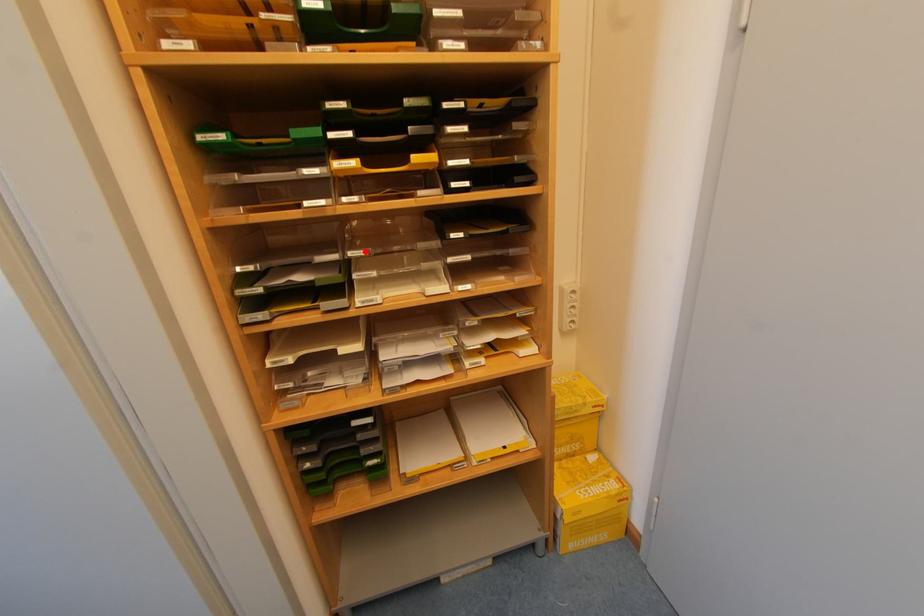
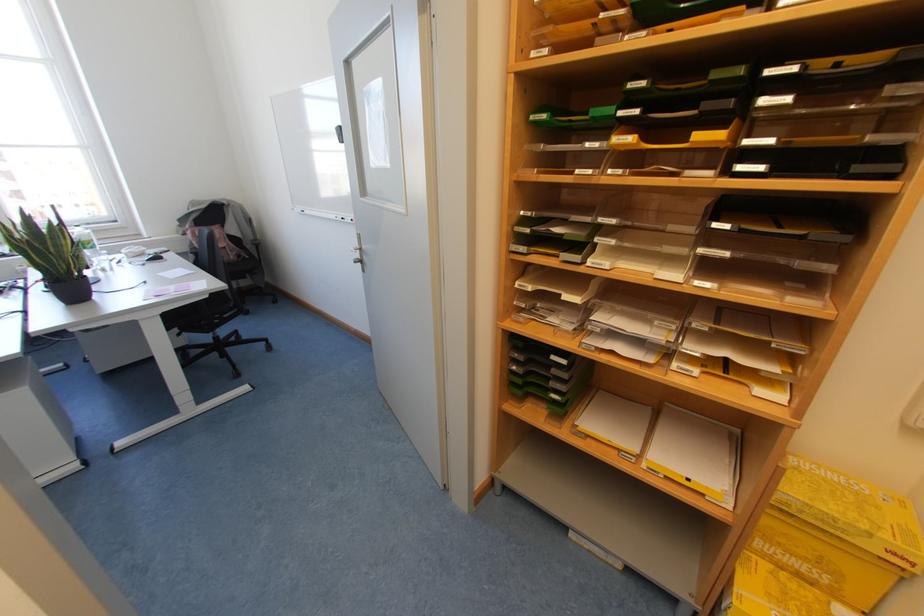
Question: I am providing you with two images of the same scene from different viewpoints. A red point is marked on the first image. Is the red point's position out of view in image 2?

Choices:
 (A) Yes
 (B) No

Answer: (B)